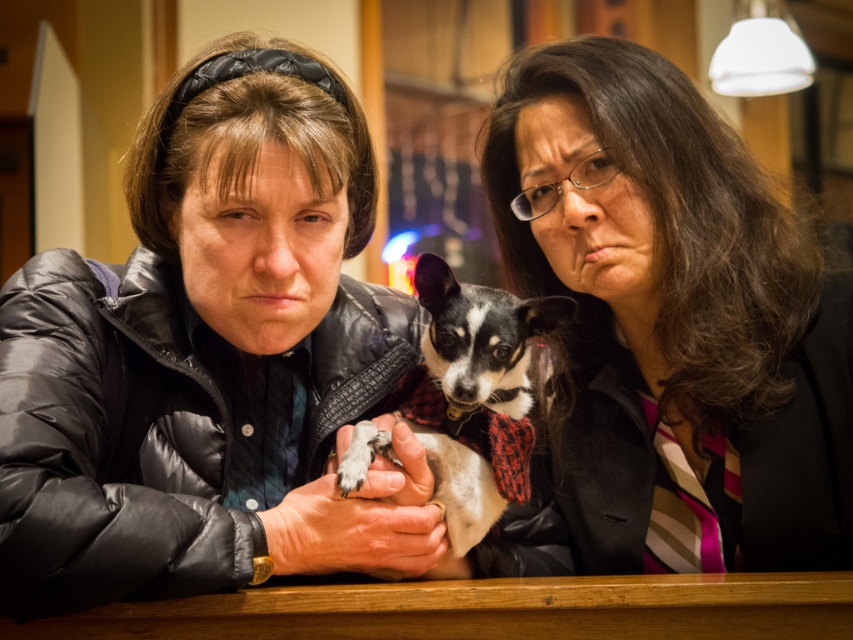
You are standing in a cozy indoor setting and see the matte black jacket at center. If you want to reach it without moving your feet, is the distance too far?

Result: The distance between you and the matte black jacket at center is 3.80 feet, which is too far to reach without moving your feet.

You are standing in the room and want to locate the black quilted jacket at center. Which object in the image corresponds to the coordinates point (209, 356)?

The black quilted jacket at center is represented by point (209, 356).